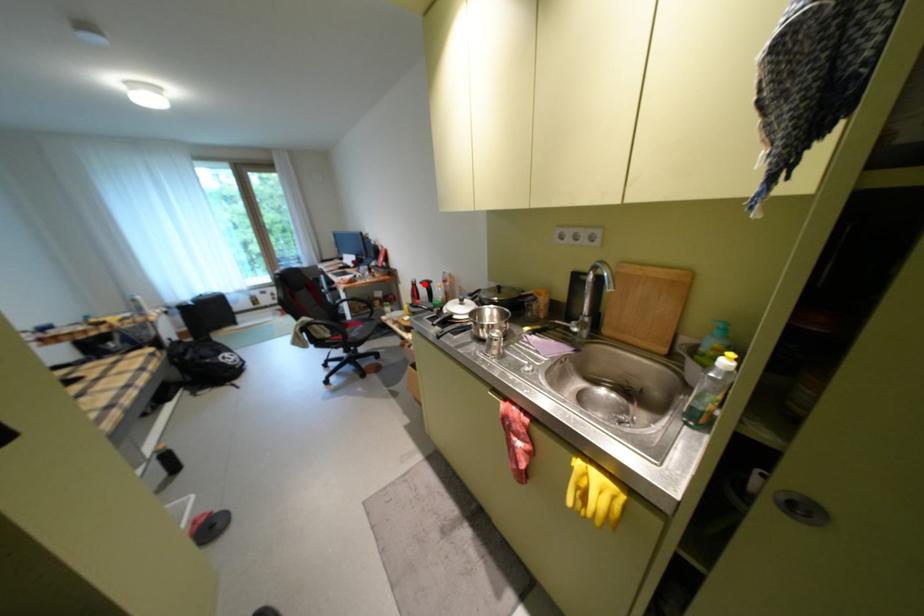
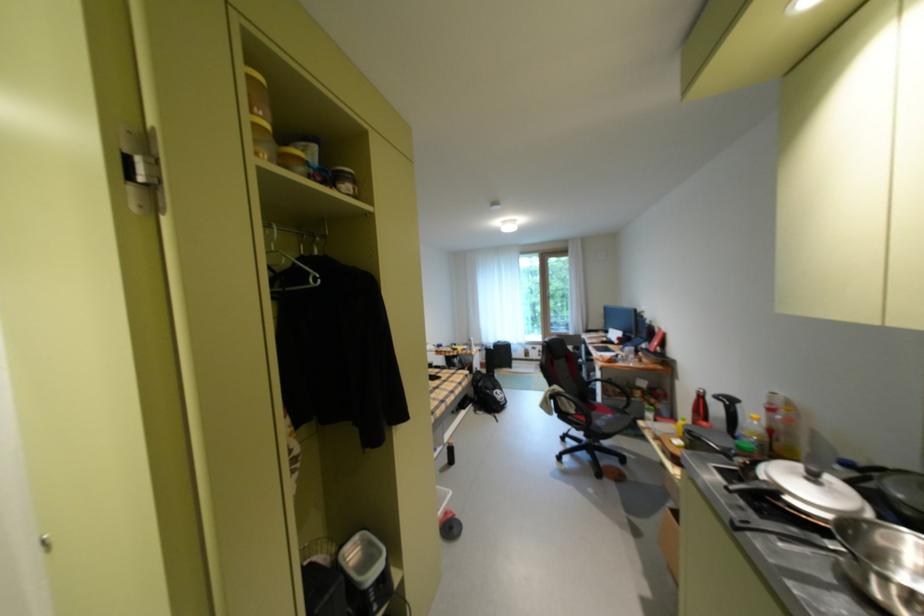
Find the pixel in the second image that matches the highlighted location in the first image.

(712, 395)